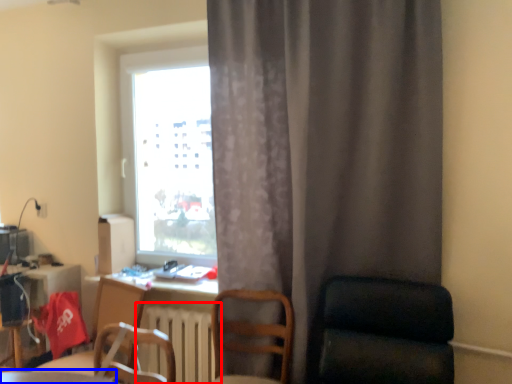
Question: Which point is further to the camera, radiator (highlighted by a red box) or table (highlighted by a blue box)?

Choices:
 (A) radiator
 (B) table

Answer: (A)